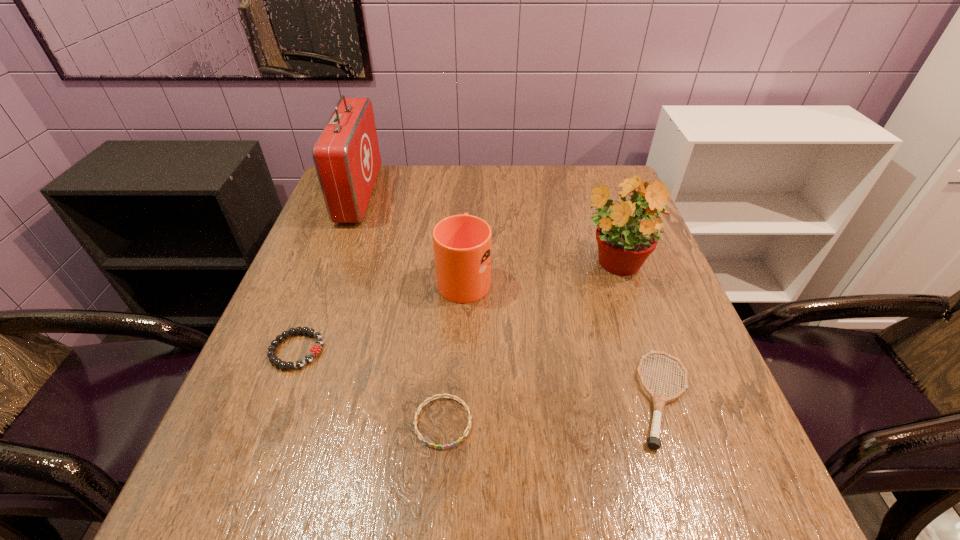
Find the location of a particular element. This screenshot has width=960, height=540. tennis racket positioned at the right edge is located at coordinates (659, 400).

What are the coordinates of `object present at the far left corner` in the screenshot? It's located at (346, 155).

Image resolution: width=960 pixels, height=540 pixels. In the image, there is a desktop. What are the coordinates of `free region at the far edge` in the screenshot? It's located at pos(433,184).

Where is `vacant space at the near edge of the desktop`? Image resolution: width=960 pixels, height=540 pixels. vacant space at the near edge of the desktop is located at coordinates (368, 492).

At what (x,y) coordinates should I click in order to perform the action: click on free space at the left edge of the desktop. Please return your answer as a coordinate pair (x, y). Image resolution: width=960 pixels, height=540 pixels. Looking at the image, I should click on (319, 373).

Locate an element on the screen. free space at the right edge is located at coordinates (660, 283).

The width and height of the screenshot is (960, 540). In the image, there is a desktop. Find the location of `vacant region at the near left corner`. vacant region at the near left corner is located at coordinates (x=278, y=490).

In the image, there is a desktop. Identify the location of vacant space at the far right corner. (579, 185).

In the image, there is a desktop. Where is `vacant region at the near right corner`? vacant region at the near right corner is located at coordinates (698, 501).

You are a GUI agent. You are given a task and a screenshot of the screen. Output one action in this format:
    pyautogui.click(x=<x>, y=<y>)
    Task: Click on the free spot between the shortest object and the left bracelet
    
    Given the screenshot: What is the action you would take?
    pyautogui.click(x=370, y=386)